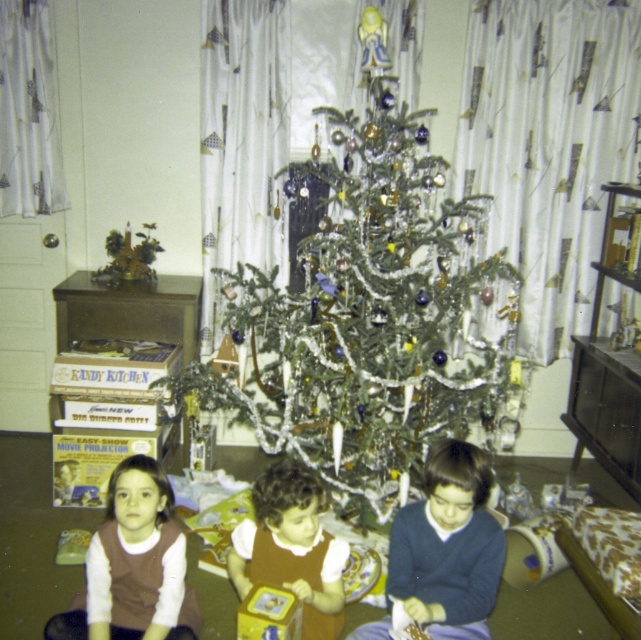
Can you confirm if green shiny tree at center is positioned to the left of brown velvety shirt at lower left?

Incorrect, green shiny tree at center is not on the left side of brown velvety shirt at lower left.

Who is more forward, (265, 404) or (133, 467)?

Point (133, 467) is more forward.

The width and height of the screenshot is (641, 640). In order to click on green shiny tree at center in this screenshot , I will do `click(367, 314)`.

This screenshot has width=641, height=640. I want to click on green shiny tree at center, so click(367, 314).

In the scene shown: Is green shiny tree at center above brown velvet dress at center?

Correct, green shiny tree at center is located above brown velvet dress at center.

Is green shiny tree at center thinner than brown velvet dress at center?

In fact, green shiny tree at center might be wider than brown velvet dress at center.

Where is `green shiny tree at center`? green shiny tree at center is located at coordinates (367, 314).

Can you confirm if dark blue sweater at center is thinner than brown velvet dress at center?

In fact, dark blue sweater at center might be wider than brown velvet dress at center.

Measure the distance between dark blue sweater at center and camera.

dark blue sweater at center is 6.10 feet from camera.

Is point (426, 620) farther from viewer compared to point (244, 552)?

No, (426, 620) is closer to viewer.

At what (x,y) coordinates should I click in order to perform the action: click on dark blue sweater at center. Please return your answer as a coordinate pair (x, y). Looking at the image, I should click on (447, 545).